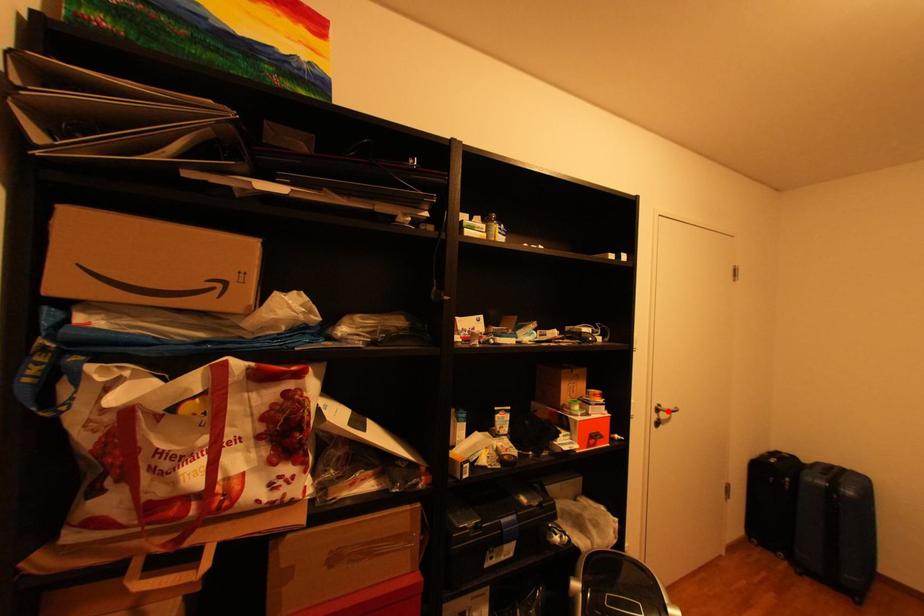
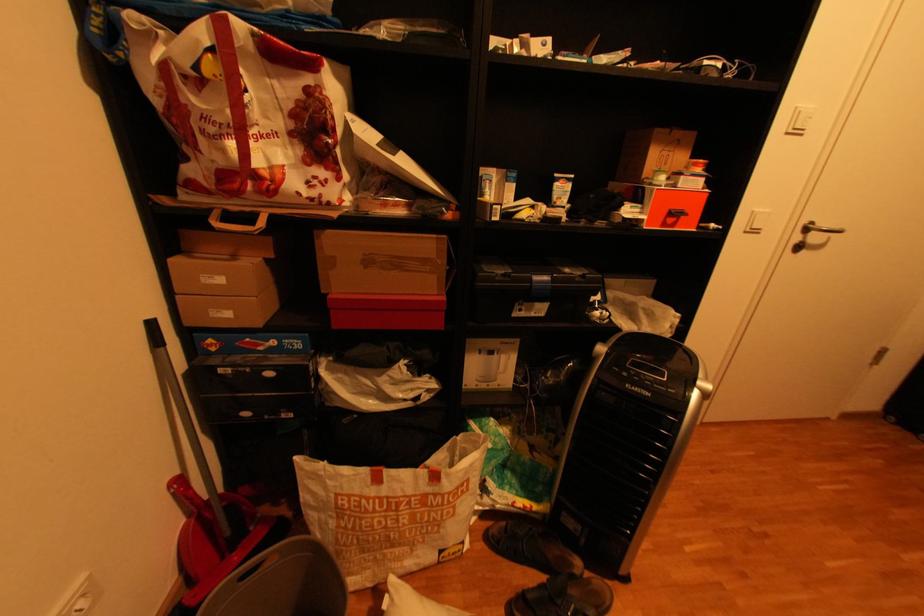
Where in the second image is the point corresponding to the highlighted location from the first image?

(816, 230)